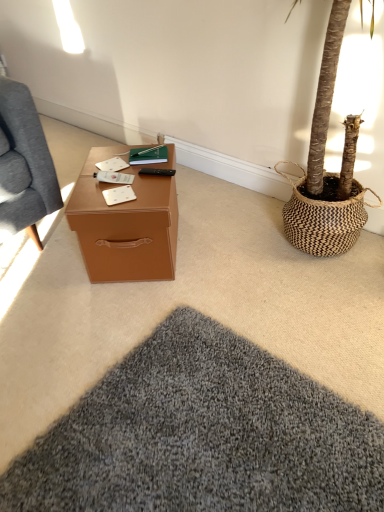
Find the location of a particular element. free spot in front of black matte remote control at center is located at coordinates (146, 193).